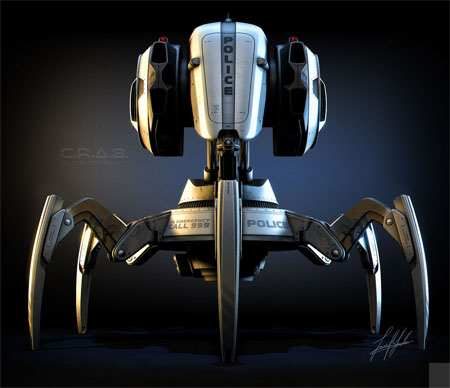
Identify the location of red lights. This screenshot has width=450, height=388. (161, 36), (293, 37).